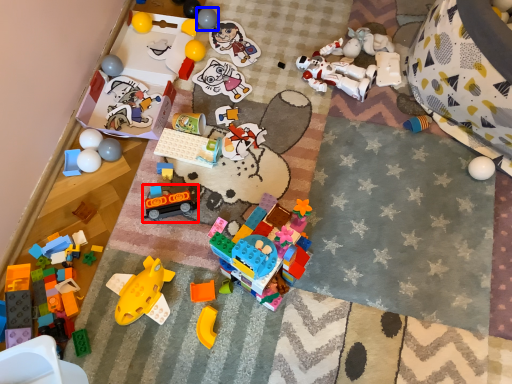
Question: Which object appears closest to the camera in this image, toy (highlighted by a red box) or toy (highlighted by a blue box)?

Choices:
 (A) toy
 (B) toy

Answer: (A)